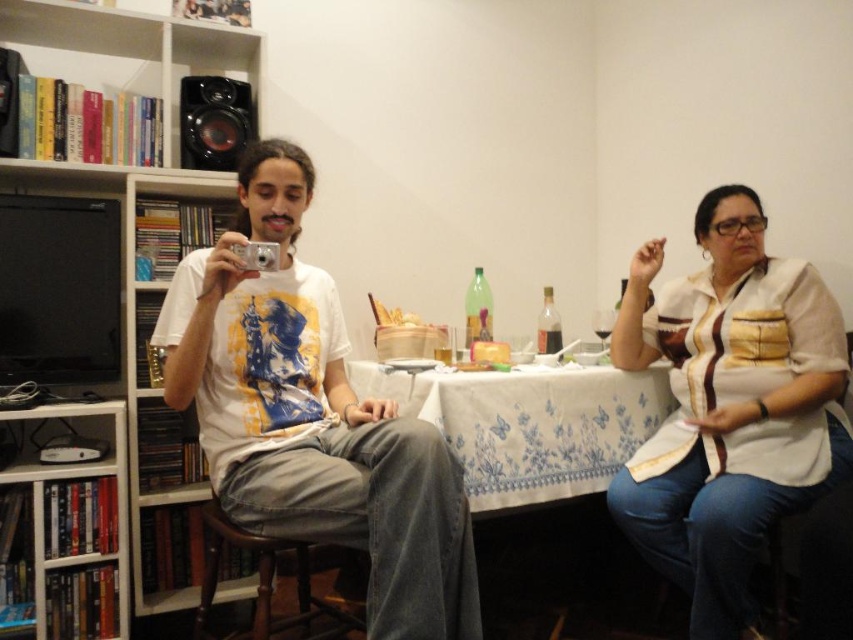
Question: Which point is closer to the camera taking this photo?

Choices:
 (A) (212, 579)
 (B) (666, 465)
 (C) (123, 275)

Answer: (A)

Question: Among these objects, which one is farthest from the camera?

Choices:
 (A) white wood bookcase at left
 (B) white cotton t-shirt at center
 (C) white cotton shirt at center
 (D) brown wooden chair at lower left

Answer: (A)

Question: Which object appears closest to the camera in this image?

Choices:
 (A) brown wooden chair at lower left
 (B) white wood bookcase at left
 (C) white cotton shirt at center
 (D) white cotton t-shirt at center

Answer: (C)

Question: Is white cotton t-shirt at center positioned before white wood bookcase at left?

Choices:
 (A) no
 (B) yes

Answer: (B)

Question: In this image, where is white cotton t-shirt at center located relative to brown wooden chair at lower left?

Choices:
 (A) right
 (B) left

Answer: (A)

Question: Does white textured blouse at right have a greater width compared to white wood bookcase at left?

Choices:
 (A) no
 (B) yes

Answer: (A)